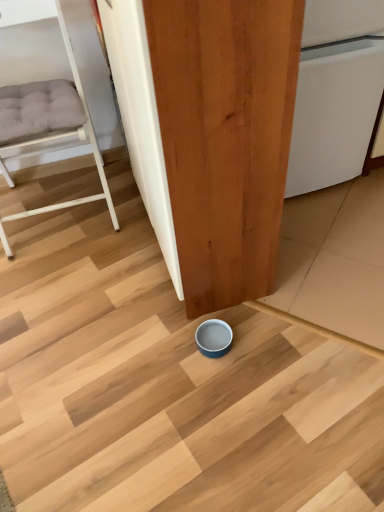
Question: Is white glossy dishwasher at center to the left of matte wood door at center from the viewer's perspective?

Choices:
 (A) no
 (B) yes

Answer: (A)

Question: Is white glossy dishwasher at center wider than matte wood door at center?

Choices:
 (A) no
 (B) yes

Answer: (B)

Question: From a real-world perspective, is white glossy dishwasher at center located higher than matte wood door at center?

Choices:
 (A) yes
 (B) no

Answer: (B)

Question: Does white glossy dishwasher at center appear on the right side of matte wood door at center?

Choices:
 (A) no
 (B) yes

Answer: (B)

Question: Is white glossy dishwasher at center not inside matte wood door at center?

Choices:
 (A) yes
 (B) no

Answer: (A)

Question: From the image's perspective, is white glossy dishwasher at center over matte wood door at center?

Choices:
 (A) no
 (B) yes

Answer: (B)

Question: Is white glossy dishwasher at center at the right side of white matte bunk bed at left?

Choices:
 (A) no
 (B) yes

Answer: (B)

Question: Does white glossy dishwasher at center have a lesser height compared to white matte bunk bed at left?

Choices:
 (A) yes
 (B) no

Answer: (A)

Question: Can you confirm if white glossy dishwasher at center is positioned to the left of white matte bunk bed at left?

Choices:
 (A) no
 (B) yes

Answer: (A)

Question: From a real-world perspective, is white glossy dishwasher at center physically below white matte bunk bed at left?

Choices:
 (A) yes
 (B) no

Answer: (A)

Question: Is white glossy dishwasher at center outside white matte bunk bed at left?

Choices:
 (A) yes
 (B) no

Answer: (A)

Question: Is white glossy dishwasher at center next to white matte bunk bed at left?

Choices:
 (A) no
 (B) yes

Answer: (A)

Question: From a real-world perspective, does white matte bunk bed at left stand above white glossy dishwasher at center?

Choices:
 (A) no
 (B) yes

Answer: (B)